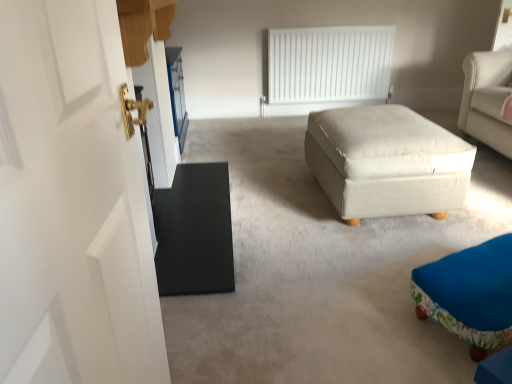
Question: Relative to white fabric ottoman at center, positioned as the first table in right-to-left order, is floral fabric ottoman at lower right in front or behind?

Choices:
 (A) behind
 (B) front

Answer: (B)

Question: In terms of height, does floral fabric ottoman at lower right look taller or shorter compared to white fabric ottoman at center, marked as the 2th table in a left-to-right arrangement?

Choices:
 (A) short
 (B) tall

Answer: (A)

Question: Estimate the real-world distances between objects in this image. Which object is closer to the white matte radiator at upper center?

Choices:
 (A) black matte table at left, the 2th table when ordered from right to left
 (B) floral fabric ottoman at lower right
 (C) black matte door at left
 (D) white fabric ottoman at center, marked as the 2th table in a left-to-right arrangement

Answer: (D)

Question: Considering the real-world distances, which object is closest to the white matte radiator at upper center?

Choices:
 (A) white fabric ottoman at center, marked as the 2th table in a left-to-right arrangement
 (B) floral fabric ottoman at lower right
 (C) black matte table at left, marked as the first table in a left-to-right arrangement
 (D) black matte door at left

Answer: (A)